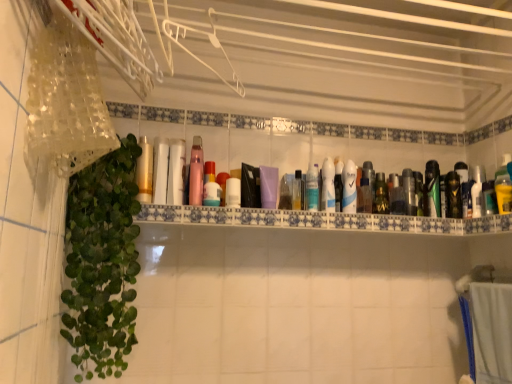
Question: From the image's perspective, is matte purple bottle at center, the 7th mouthwash when ordered from left to right, above or below translucent plastic bottle at center, which is the 8th mouthwash from left to right?

Choices:
 (A) above
 (B) below

Answer: (A)

Question: Considering the positions of matte purple bottle at center, the 7th mouthwash when ordered from left to right, and translucent plastic bottle at center, the 11th mouthwash when ordered from right to left, in the image, is matte purple bottle at center, the 7th mouthwash when ordered from left to right, taller or shorter than translucent plastic bottle at center, the 11th mouthwash when ordered from right to left,?

Choices:
 (A) tall
 (B) short

Answer: (B)

Question: Which of these objects is positioned closest to the metallic silver mouthwash at center-right, which is counted as the 15th mouthwash, starting from the left?

Choices:
 (A) clear plastic bottle at center, which is the 14th mouthwash from left to right
 (B) white glossy mouthwash at center, which is the 10th mouthwash from left to right
 (C) gold metallic tube at center, marked as the 18th mouthwash in a right-to-left arrangement
 (D) translucent plastic bottle at center, the fourth mouthwash viewed from the left
 (E) yellow matte bottle at right, which appears as the eighteenth mouthwash when viewed from the left

Answer: (A)

Question: Estimate the real-world distances between objects in this image. Which object is closer to the blue glossy mouthwash at center, which appears as the 10th mouthwash when viewed from the right?

Choices:
 (A) white plastic hanger at upper center
 (B) metallic silver mouthwash at center-right, which is counted as the 15th mouthwash, starting from the left
 (C) translucent plastic bottle at center, the fourth mouthwash viewed from the left
 (D) clear plastic bottle at center, the seventh mouthwash from the right
 (E) white glossy bottle at center, acting as the sixth mouthwash starting from the left

Answer: (D)